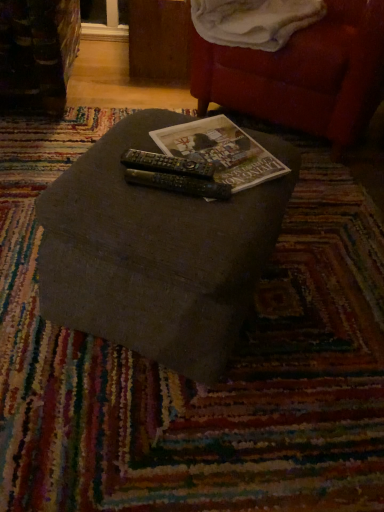
Question: Can you confirm if velvet red bean bag chair at upper right is positioned to the left of black plastic remote at center, arranged as the first remote when viewed from the front?

Choices:
 (A) yes
 (B) no

Answer: (B)

Question: Is velvet red bean bag chair at upper right smaller than black plastic remote at center, acting as the second remote starting from the back?

Choices:
 (A) no
 (B) yes

Answer: (A)

Question: From the image's perspective, is velvet red bean bag chair at upper right located beneath black plastic remote at center, acting as the second remote starting from the back?

Choices:
 (A) yes
 (B) no

Answer: (B)

Question: Considering the relative positions of velvet red bean bag chair at upper right and black plastic remote at center, arranged as the first remote when viewed from the front, in the image provided, is velvet red bean bag chair at upper right behind black plastic remote at center, arranged as the first remote when viewed from the front,?

Choices:
 (A) yes
 (B) no

Answer: (A)

Question: Does velvet red bean bag chair at upper right turn towards black plastic remote at center, arranged as the first remote when viewed from the front?

Choices:
 (A) no
 (B) yes

Answer: (B)

Question: Considering the relative positions of black plastic remote at center, acting as the second remote starting from the back, and textured gray ottoman at center in the image provided, is black plastic remote at center, acting as the second remote starting from the back, to the left or to the right of textured gray ottoman at center?

Choices:
 (A) left
 (B) right

Answer: (B)

Question: Considering the positions of black plastic remote at center, arranged as the first remote when viewed from the front, and textured gray ottoman at center in the image, is black plastic remote at center, arranged as the first remote when viewed from the front, taller or shorter than textured gray ottoman at center?

Choices:
 (A) short
 (B) tall

Answer: (A)

Question: Considering the positions of point (225, 195) and point (218, 265), is point (225, 195) closer or farther from the camera than point (218, 265)?

Choices:
 (A) closer
 (B) farther

Answer: (B)

Question: Is black plastic remote at center, arranged as the first remote when viewed from the front, inside the boundaries of textured gray ottoman at center, or outside?

Choices:
 (A) inside
 (B) outside

Answer: (A)

Question: Based on their positions, is velvet red bean bag chair at upper right located to the left or right of black plastic remote at center, the 1th remote in the back-to-front sequence?

Choices:
 (A) left
 (B) right

Answer: (B)

Question: Considering the positions of velvet red bean bag chair at upper right and black plastic remote at center, the 2th remote viewed from the front, in the image, is velvet red bean bag chair at upper right taller or shorter than black plastic remote at center, the 2th remote viewed from the front,?

Choices:
 (A) tall
 (B) short

Answer: (A)

Question: Is velvet red bean bag chair at upper right in front of or behind black plastic remote at center, the 2th remote viewed from the front, in the image?

Choices:
 (A) front
 (B) behind

Answer: (B)

Question: From the image's perspective, is velvet red bean bag chair at upper right above or below black plastic remote at center, the 1th remote in the back-to-front sequence?

Choices:
 (A) below
 (B) above

Answer: (B)

Question: In terms of size, does black plastic remote at center, the 1th remote in the back-to-front sequence, appear bigger or smaller than textured gray ottoman at center?

Choices:
 (A) small
 (B) big

Answer: (A)

Question: Is black plastic remote at center, the 1th remote in the back-to-front sequence, taller or shorter than textured gray ottoman at center?

Choices:
 (A) short
 (B) tall

Answer: (A)